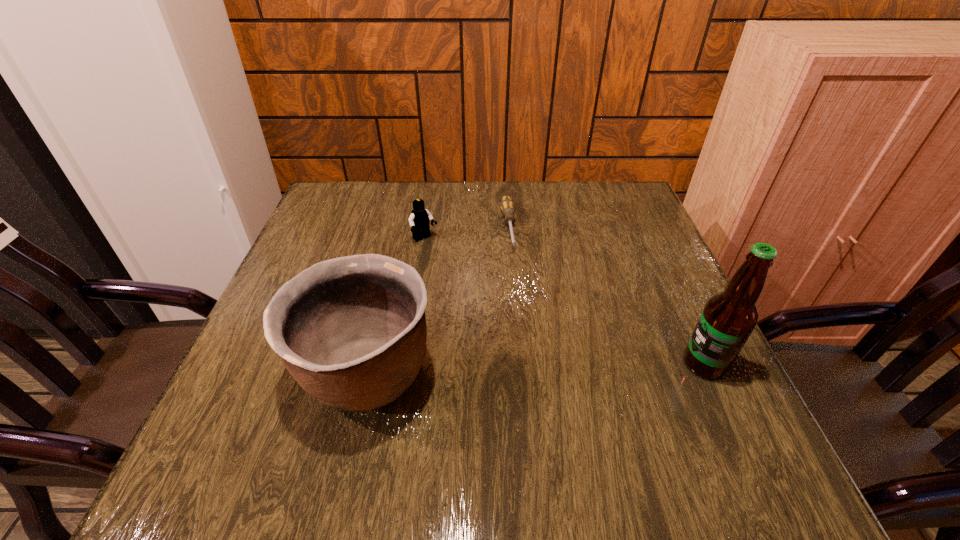
Find the location of a particular element. The width and height of the screenshot is (960, 540). vacant space on the desktop that is between the pottery and the tallest object and is positioned at the tip of the shortest object is located at coordinates (532, 369).

Locate an element on the screen. vacant space on the desktop that is between the second tallest object and the beer bottle and is positioned on the front-facing side of the third tallest object is located at coordinates (540, 369).